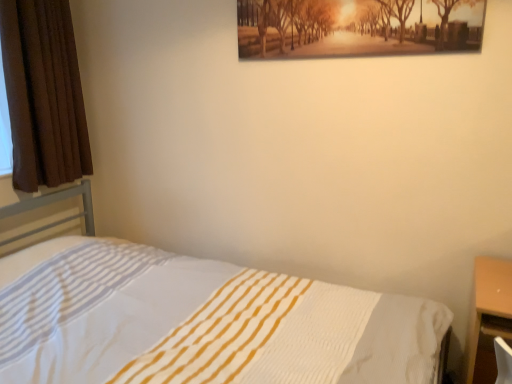
Question: Considering the relative sizes of brown velvet curtain at left and white textured bed at center in the image provided, is brown velvet curtain at left wider than white textured bed at center?

Choices:
 (A) yes
 (B) no

Answer: (B)

Question: From the image's perspective, would you say brown velvet curtain at left is positioned over white textured bed at center?

Choices:
 (A) yes
 (B) no

Answer: (A)

Question: From the image's perspective, does brown velvet curtain at left appear lower than white textured bed at center?

Choices:
 (A) no
 (B) yes

Answer: (A)

Question: Is white textured bed at center at the back of brown velvet curtain at left?

Choices:
 (A) no
 (B) yes

Answer: (A)

Question: Is brown velvet curtain at left taller than white textured bed at center?

Choices:
 (A) no
 (B) yes

Answer: (B)

Question: From the image's perspective, is brown velvet curtain at left located above or below matte wooden picture frame at upper center?

Choices:
 (A) below
 (B) above

Answer: (A)

Question: Considering the positions of brown velvet curtain at left and matte wooden picture frame at upper center in the image, is brown velvet curtain at left wider or thinner than matte wooden picture frame at upper center?

Choices:
 (A) wide
 (B) thin

Answer: (A)

Question: Visually, is brown velvet curtain at left positioned to the left or to the right of matte wooden picture frame at upper center?

Choices:
 (A) left
 (B) right

Answer: (A)

Question: From a real-world perspective, relative to matte wooden picture frame at upper center, is brown velvet curtain at left vertically above or below?

Choices:
 (A) below
 (B) above

Answer: (A)

Question: From a real-world perspective, relative to white textured bed at center, is brown velvet curtain at left vertically above or below?

Choices:
 (A) below
 (B) above

Answer: (B)

Question: Is brown velvet curtain at left wider or thinner than white textured bed at center?

Choices:
 (A) thin
 (B) wide

Answer: (A)

Question: Is brown velvet curtain at left in front of or behind white textured bed at center in the image?

Choices:
 (A) behind
 (B) front

Answer: (A)

Question: From the image's perspective, is brown velvet curtain at left above or below white textured bed at center?

Choices:
 (A) below
 (B) above

Answer: (B)

Question: Considering the positions of matte wooden picture frame at upper center and brown velvet curtain at left in the image, is matte wooden picture frame at upper center bigger or smaller than brown velvet curtain at left?

Choices:
 (A) big
 (B) small

Answer: (B)

Question: Relative to brown velvet curtain at left, is matte wooden picture frame at upper center in front or behind?

Choices:
 (A) front
 (B) behind

Answer: (A)